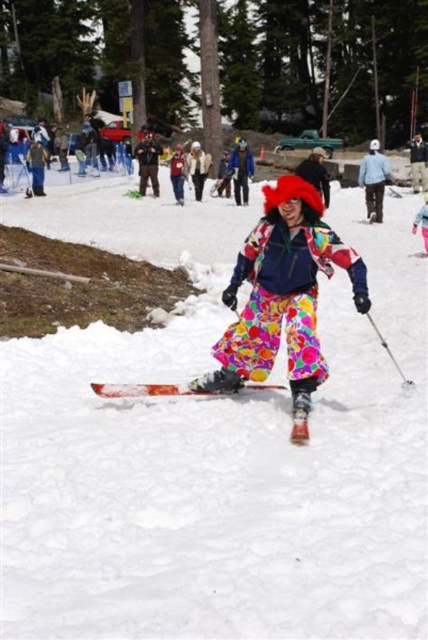
You are a drone operator tasked with capturing aerial footage of the orange metallic ski at center and the fluorescent yellow snow pants at center. The drone has a maximum range of 20 meters. Can the drone capture both objects in a single shot without moving beyond its range?

The distance between the orange metallic ski at center and the fluorescent yellow snow pants at center is 23.71 meters. Since the drone has a maximum range of 20 meters, it cannot capture both objects in a single shot without exceeding its range.

Looking at this image, you are a ski equipment inspector and need to ensure that the orange metallic ski at center and the fluorescent yellow snow pants at center comply with safety regulations. According to the description, which item is wider?

The orange metallic ski at center is wider than the fluorescent yellow snow pants at center according to the description.

You are a photographer trying to capture the orange metallic ski at center and the fluorescent yellow snow pants at center in a single photo. Which object should you focus on first to ensure both are in the frame?

You should focus on the orange metallic ski at center first because it is closer to the viewer than the fluorescent yellow snow pants at center, ensuring both are in the frame.